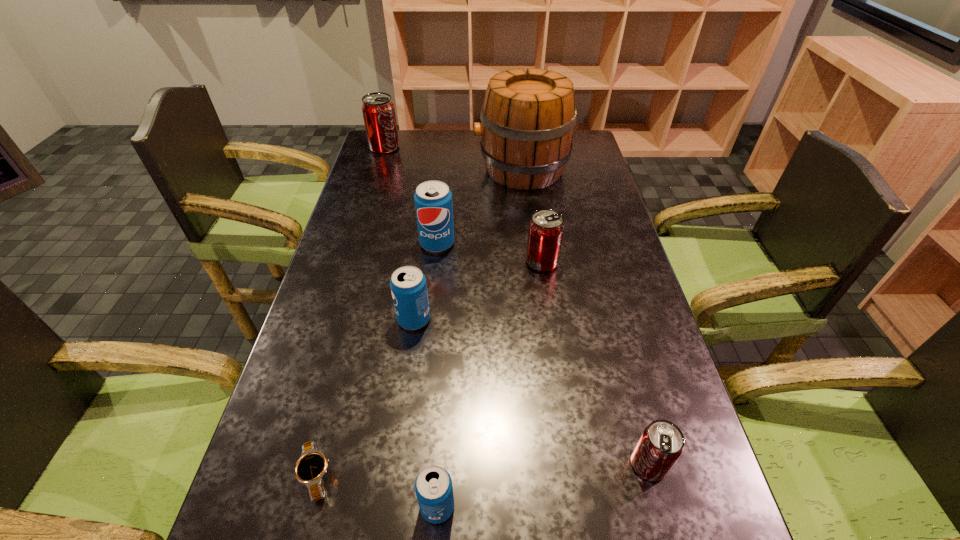
What are the coordinates of `object present at the far left corner` in the screenshot? It's located at (378, 110).

Where is `object situated at the far right corner`? This screenshot has width=960, height=540. object situated at the far right corner is located at coordinates (528, 118).

Where is `vacant space at the far edge of the desktop`? The width and height of the screenshot is (960, 540). vacant space at the far edge of the desktop is located at coordinates (435, 139).

You are a GUI agent. You are given a task and a screenshot of the screen. Output one action in this format:
    pyautogui.click(x=<x>, y=<y>)
    Task: Click on the vacant space at the left edge
    Image resolution: width=960 pixels, height=540 pixels.
    Given the screenshot: What is the action you would take?
    pyautogui.click(x=369, y=162)

At what (x,y) coordinates should I click in order to perform the action: click on free location at the right edge of the desktop. Please return your answer as a coordinate pair (x, y). Looking at the image, I should click on (594, 311).

Image resolution: width=960 pixels, height=540 pixels. Identify the location of free spot between the second nearest red pop soda and the smallest blue soda can. (490, 384).

Image resolution: width=960 pixels, height=540 pixels. Find the location of `blank region between the second farthest red pop soda and the second farthest blue soda can`. blank region between the second farthest red pop soda and the second farthest blue soda can is located at coordinates (478, 291).

Locate an element on the screen. The height and width of the screenshot is (540, 960). free point between the black watch and the fifth soda can from left to right is located at coordinates (429, 369).

You are a GUI agent. You are given a task and a screenshot of the screen. Output one action in this format:
    pyautogui.click(x=<x>, y=<y>)
    Task: Click on the empty space that is in between the biggest blue soda can and the second soda can from right to left
    
    Given the screenshot: What is the action you would take?
    pyautogui.click(x=490, y=253)

Where is `vacant point located between the watch and the farthest soda can`? vacant point located between the watch and the farthest soda can is located at coordinates (350, 312).